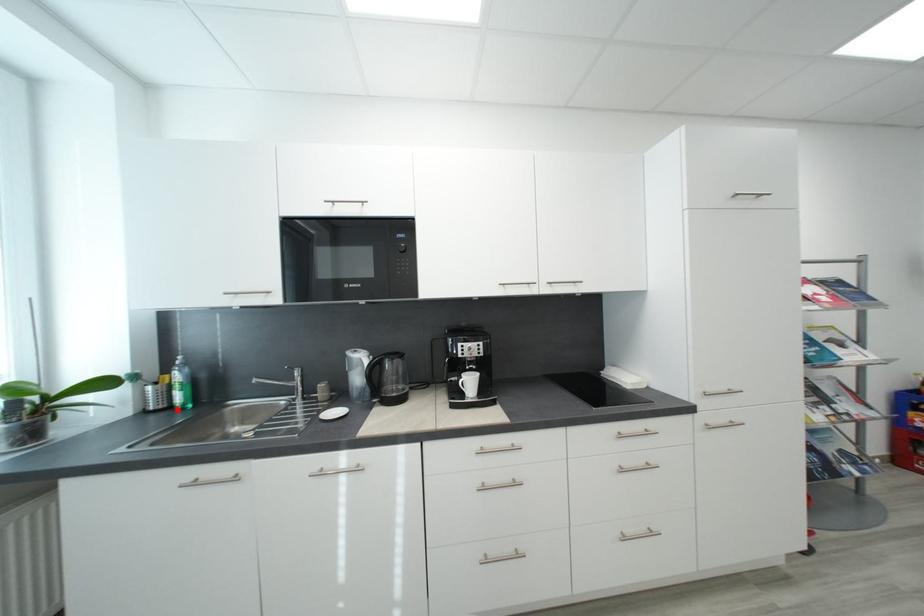
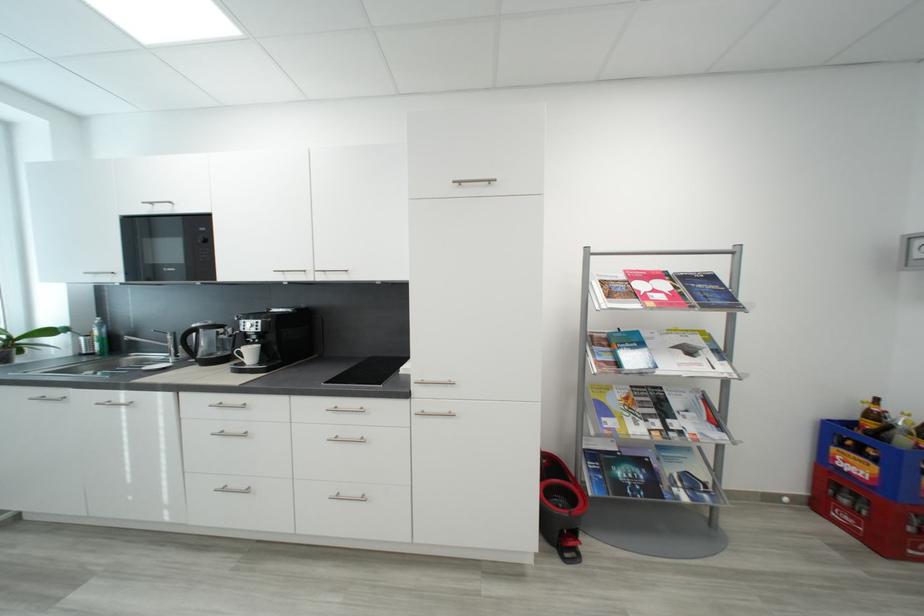
Find the pixel in the second image that matches the highlighted location in the first image.

(100, 355)